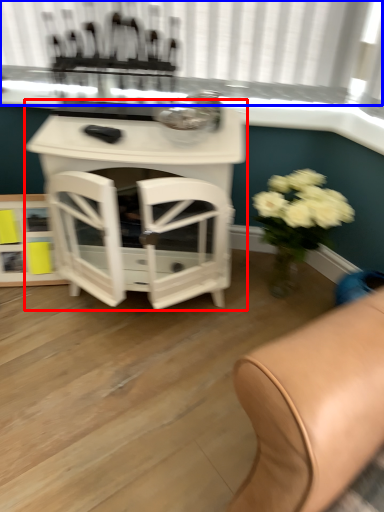
Question: Which point is closer to the camera, table (highlighted by a red box) or bay window (highlighted by a blue box)?

Choices:
 (A) table
 (B) bay window

Answer: (A)